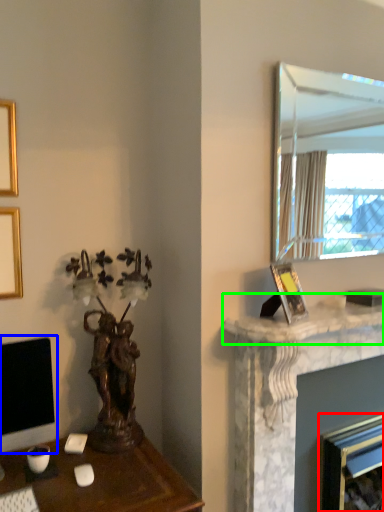
Question: Estimate the real-world distances between objects in this image. Which object is closer to fireplace (highlighted by a red box), computer monitor (highlighted by a blue box) or counter top (highlighted by a green box)?

Choices:
 (A) computer monitor
 (B) counter top

Answer: (B)